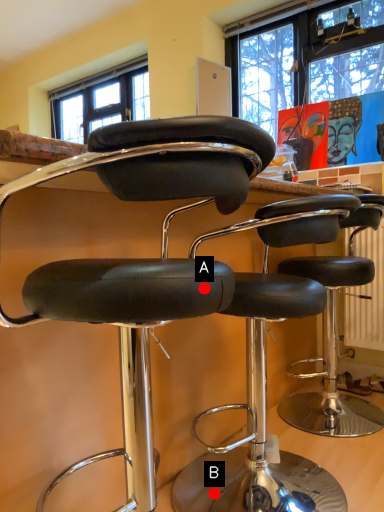
Question: Two points are circled on the image, labeled by A and B beside each circle. Which point is farther to the camera?

Choices:
 (A) A is further
 (B) B is further

Answer: (B)